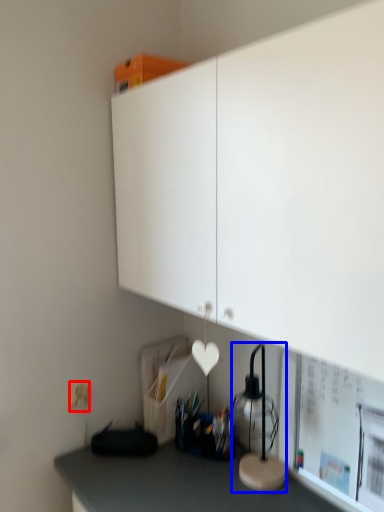
Question: Among these objects, which one is farthest to the camera, electric outlet (highlighted by a red box) or table lamp (highlighted by a blue box)?

Choices:
 (A) electric outlet
 (B) table lamp

Answer: (A)